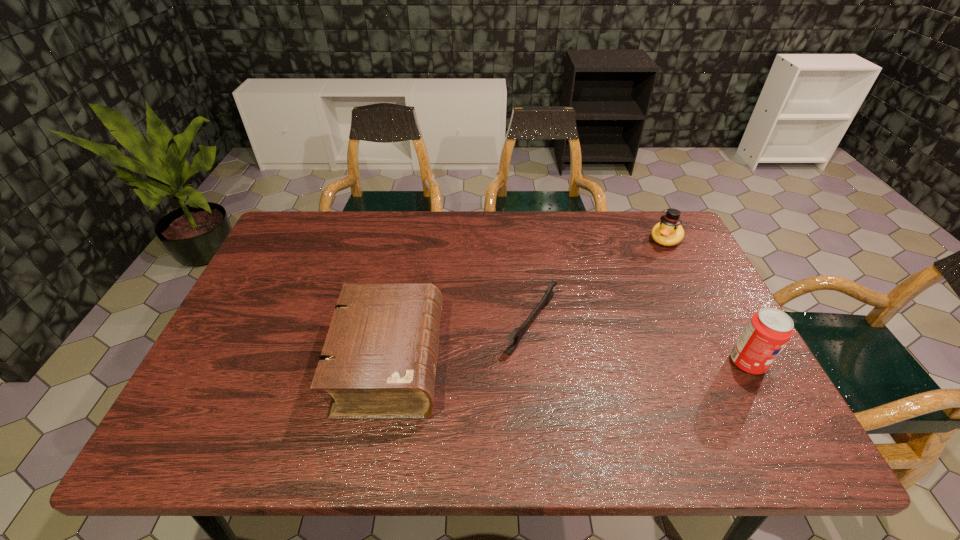
Image resolution: width=960 pixels, height=540 pixels. Identify the location of free space on the desktop that is between the leftmost object and the soda can and is positioned on the open ends of the shortest object. (617, 363).

Where is `free spot on the desktop that is between the Bible and the tallest object and is positioned on the front-facing side of the duck`? free spot on the desktop that is between the Bible and the tallest object and is positioned on the front-facing side of the duck is located at coordinates (573, 363).